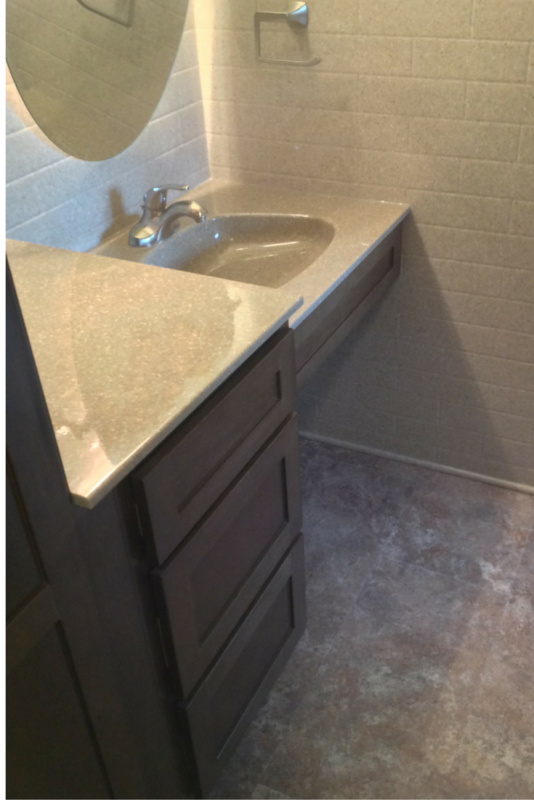
The image size is (534, 800). What are the coordinates of `cabinet` in the screenshot? It's located at (47, 608).